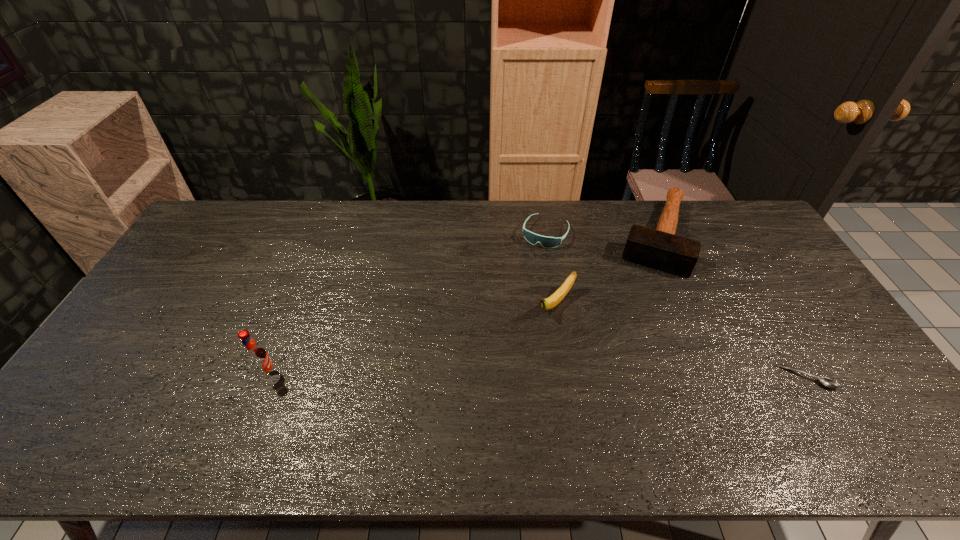
At what (x,y) coordinates should I click in order to perform the action: click on vacant space located on the front-facing side of the goggles. Please return your answer as a coordinate pair (x, y). The height and width of the screenshot is (540, 960). Looking at the image, I should click on (513, 298).

Find the location of `blank area located 0.170m on the front-facing side of the goggles`. blank area located 0.170m on the front-facing side of the goggles is located at coordinates (521, 281).

Where is `vacant space located at the stem of the third nearest object`? vacant space located at the stem of the third nearest object is located at coordinates (516, 343).

This screenshot has height=540, width=960. What are the coordinates of `vacant area situated at the stem of the third nearest object` in the screenshot? It's located at (495, 363).

Identify the location of vacant space located 0.340m at the stem of the third nearest object. (464, 393).

The height and width of the screenshot is (540, 960). I want to click on vacant point located on the striking face of the fourth object from left to right, so 643,309.

The height and width of the screenshot is (540, 960). Identify the location of free location located 0.270m on the striking face of the fourth object from left to right. (636, 336).

Find the location of a particular element. The height and width of the screenshot is (540, 960). free space located on the striking face of the fourth object from left to right is located at coordinates (634, 346).

What are the coordinates of `goggles located in the far edge section of the desktop` in the screenshot? It's located at (547, 242).

This screenshot has width=960, height=540. I want to click on mallet positioned at the far edge, so click(x=661, y=249).